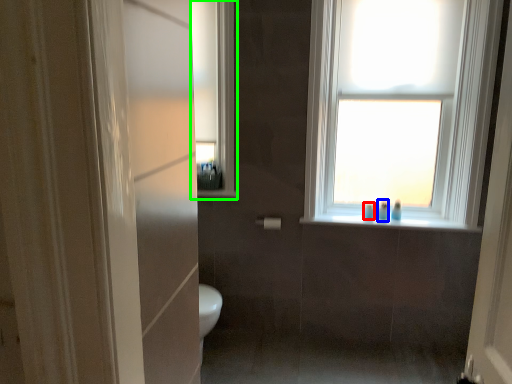
Question: Which object is positioned farthest from toiletry (highlighted by a red box)? Select from toiletry (highlighted by a blue box) and medicine cabinet (highlighted by a green box).

Choices:
 (A) toiletry
 (B) medicine cabinet

Answer: (B)